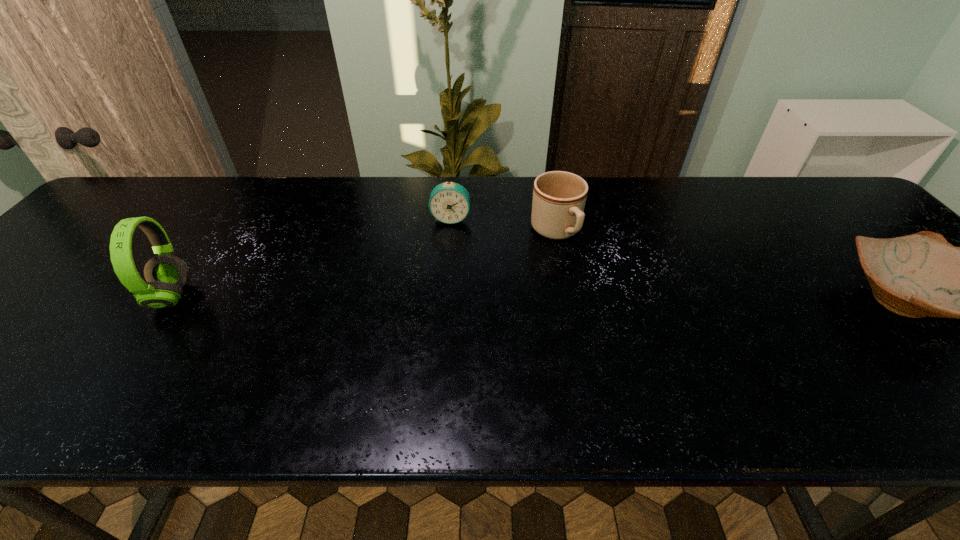
Identify which object is located as the third nearest to the pottery. Please provide its 2D coordinates. Your answer should be formatted as a tuple, i.e. [(x, y)], where the tuple contains the x and y coordinates of a point satisfying the conditions above.

[(166, 274)]